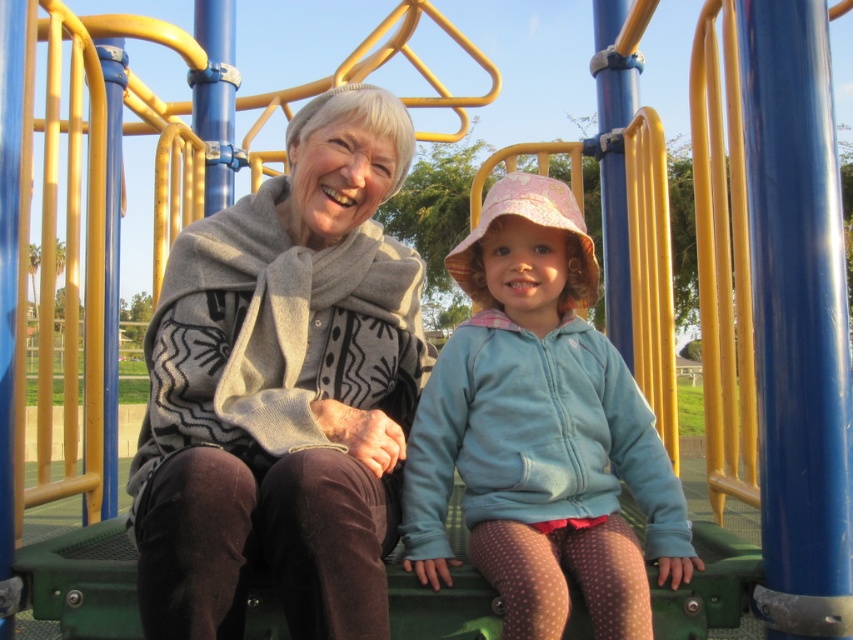
You are a photographer trying to capture a closeup of the knitted gray scarf at center and the light blue fleece jacket at center. Which object should you focus on first if you want to ensure both are in focus without moving the camera?

The knitted gray scarf at center is located above the light blue fleece jacket at center, so you should focus on the knitted gray scarf at center first since it is closer to the camera. This way, the depth of field will cover both objects effectively.

You are a photographer trying to capture a photo of the two subjects in the playground scene. You need to ensure that the knitted gray scarf at center and the light blue fleece jacket at center are both visible in the frame. Based on their positions, which item is closer to the left side of the photo?

The knitted gray scarf at center is to the left of the light blue fleece jacket at center, so it is closer to the left side of the photo.

You are taking a photo of two people sitting on a playground. There are two points marked in the image. The first point is at coordinates point (x=306, y=502) and the second point is at point (x=407, y=460). Which point is closer to the camera?

Point (x=306, y=502) is closer to the camera than point (x=407, y=460).